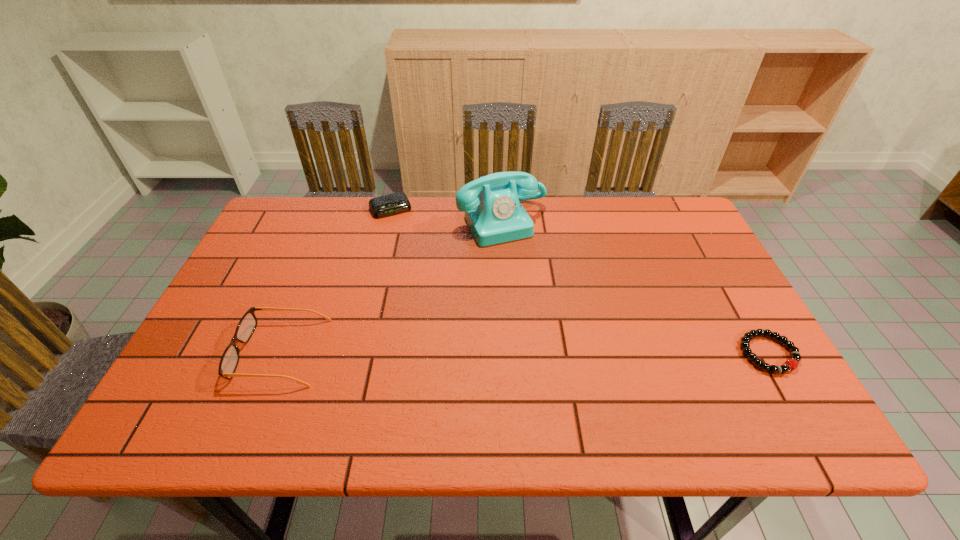
You are a GUI agent. You are given a task and a screenshot of the screen. Output one action in this format:
    pyautogui.click(x=<x>, y=<y>)
    Task: Click on the free spot between the second shortest object and the tallest object
    
    Given the screenshot: What is the action you would take?
    pyautogui.click(x=446, y=215)

At what (x,y) coordinates should I click in order to perform the action: click on the second closest object to the leftmost object. Please return your answer as a coordinate pair (x, y). The image size is (960, 540). Looking at the image, I should click on (391, 204).

Select which object appears as the closest to the third shortest object. Please provide its 2D coordinates. Your answer should be formatted as a tuple, i.e. [(x, y)], where the tuple contains the x and y coordinates of a point satisfying the conditions above.

[(493, 212)]

This screenshot has width=960, height=540. What are the coordinates of `vacant space that satisfies the following two spatial constraints: 1. on the front side of the shortest object; 2. on the left side of the second object from left to right` in the screenshot? It's located at (354, 353).

Locate an element on the screen. This screenshot has height=540, width=960. blank area in the image that satisfies the following two spatial constraints: 1. on the front side of the second object from left to right; 2. on the right side of the telephone is located at coordinates (387, 222).

Identify the location of vacant space that satisfies the following two spatial constraints: 1. on the front side of the tallest object; 2. on the right side of the alarm clock. The width and height of the screenshot is (960, 540). tap(387, 222).

Where is `vacant area that satisfies the following two spatial constraints: 1. on the front side of the third object from right to left; 2. on the right side of the telephone`? vacant area that satisfies the following two spatial constraints: 1. on the front side of the third object from right to left; 2. on the right side of the telephone is located at coordinates (387, 222).